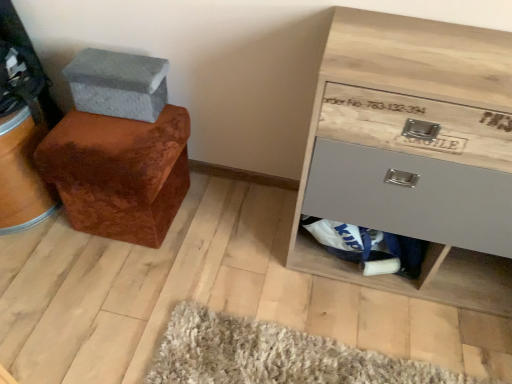
This screenshot has width=512, height=384. Identify the location of free space in front of gray fabric shoe box at upper left. (108, 135).